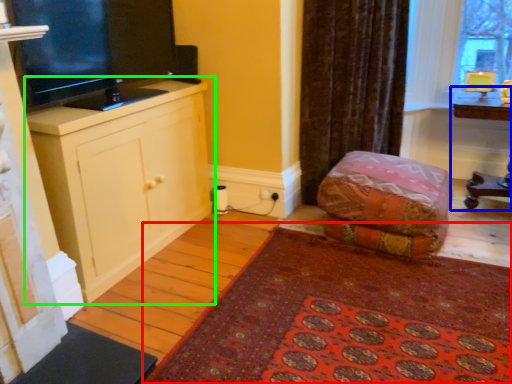
Question: Which object is the closest to the mat (highlighted by a red box)? Choose among these: table (highlighted by a blue box) or cabinetry (highlighted by a green box).

Choices:
 (A) table
 (B) cabinetry

Answer: (B)